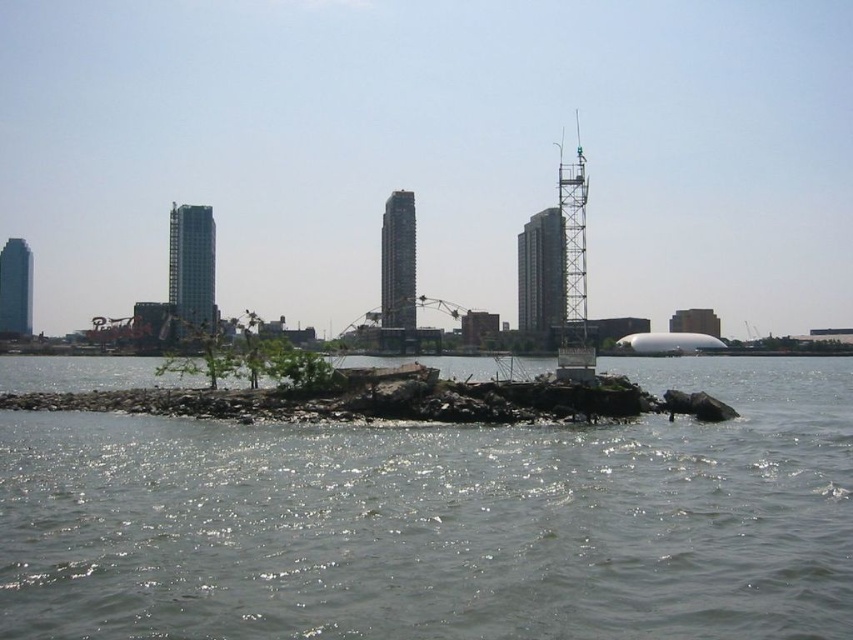
Question: Among these objects, which one is nearest to the camera?

Choices:
 (A) metallic scaffolding at right
 (B) smooth concrete skyscraper at right

Answer: (A)

Question: Is silver glass skyscraper at center-left to the left of smooth glass skyscraper at center from the viewer's perspective?

Choices:
 (A) yes
 (B) no

Answer: (A)

Question: Which object is the closest to the clear water at center?

Choices:
 (A) metallic gray tower at right
 (B) smooth concrete skyscraper at right
 (C) matte glass skyscraper at left
 (D) metallic scaffolding at right

Answer: (D)

Question: Which of the following is the farthest from the observer?

Choices:
 (A) (399, 221)
 (B) (576, 308)

Answer: (A)

Question: Observing the image, what is the correct spatial positioning of silver glass skyscraper at center-left in reference to smooth concrete skyscraper at right?

Choices:
 (A) right
 (B) left

Answer: (B)

Question: Does silver glass skyscraper at center-left appear on the right side of matte glass skyscraper at left?

Choices:
 (A) no
 (B) yes

Answer: (B)